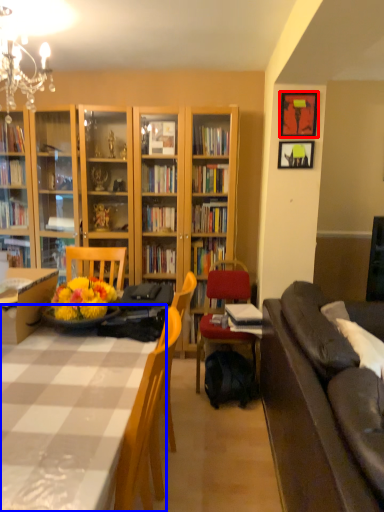
Question: Among these objects, which one is farthest to the camera, picture frame (highlighted by a red box) or table (highlighted by a blue box)?

Choices:
 (A) picture frame
 (B) table

Answer: (A)